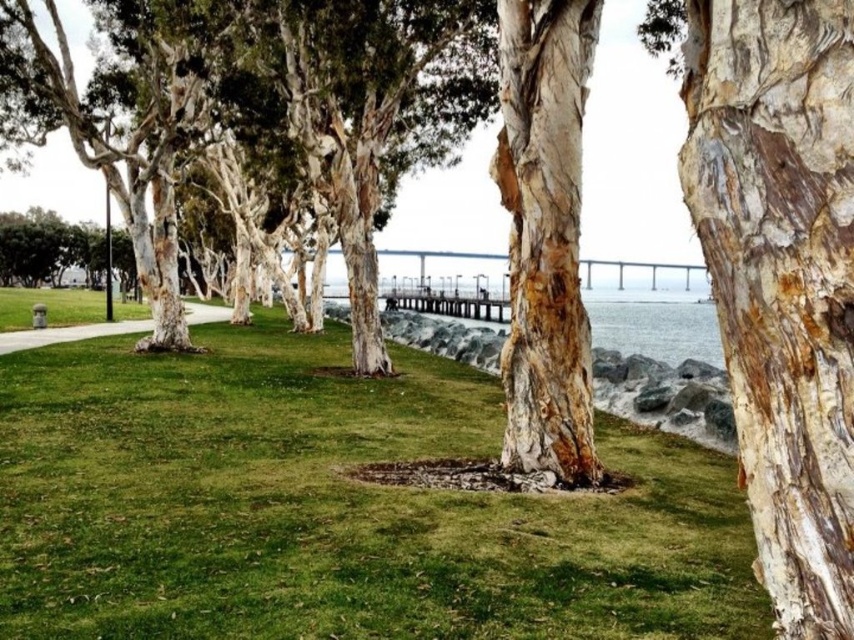
Question: Does white bark tree trunk at center have a larger size compared to green bark tree at center?

Choices:
 (A) yes
 (B) no

Answer: (B)

Question: Is green bark tree at center closer to the viewer compared to green grass at lower left?

Choices:
 (A) no
 (B) yes

Answer: (A)

Question: Which of the following is the farthest from the observer?

Choices:
 (A) pyautogui.click(x=95, y=257)
 (B) pyautogui.click(x=817, y=588)
 (C) pyautogui.click(x=522, y=445)
 (D) pyautogui.click(x=320, y=364)

Answer: (A)

Question: Can you confirm if white bark tree trunk at center is positioned below green bark tree at center?

Choices:
 (A) no
 (B) yes

Answer: (B)

Question: Which point is closer to the camera taking this photo?

Choices:
 (A) [x=231, y=593]
 (B) [x=80, y=224]
 (C) [x=845, y=403]
 (D) [x=509, y=401]

Answer: (C)

Question: Which object is farther from the camera taking this photo?

Choices:
 (A) green grass at lower left
 (B) green bark tree at center
 (C) white bark tree at center
 (D) green grass at center

Answer: (B)